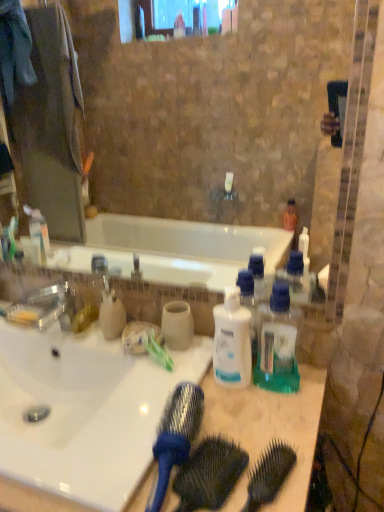
The width and height of the screenshot is (384, 512). Identify the location of vacant space that is in between black plastic brush at center, acting as the 1th brush starting from the right, and white plastic bottle at center, the 2th bottle from the right. (246, 426).